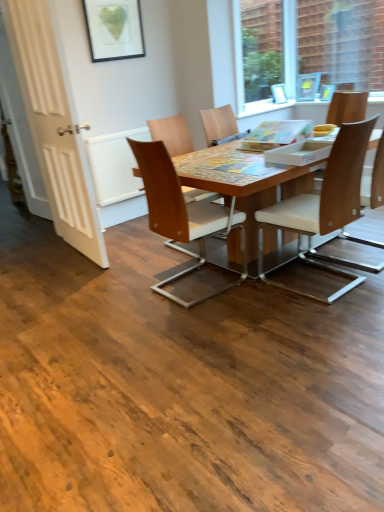
I want to click on vacant area that is in front of white wooden door at left, so click(x=77, y=279).